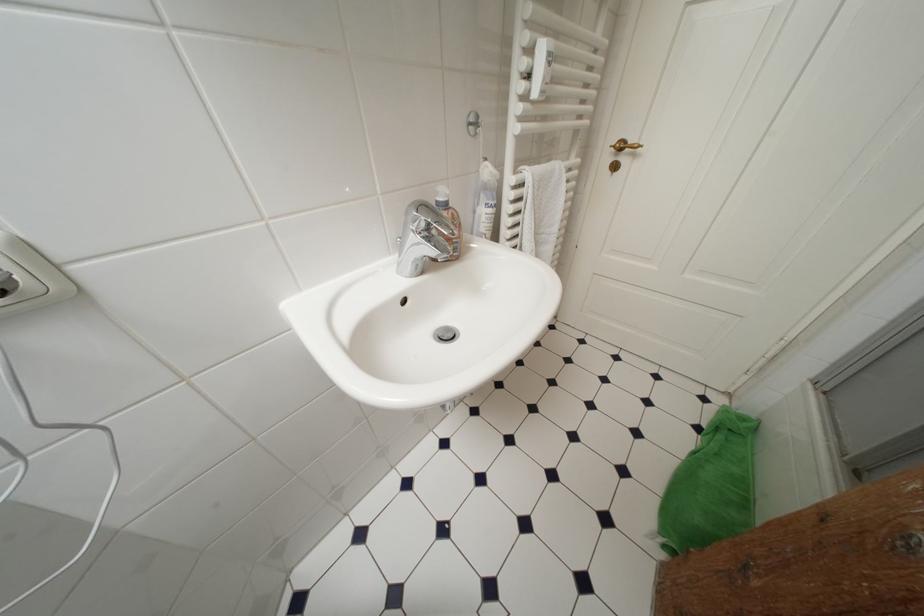
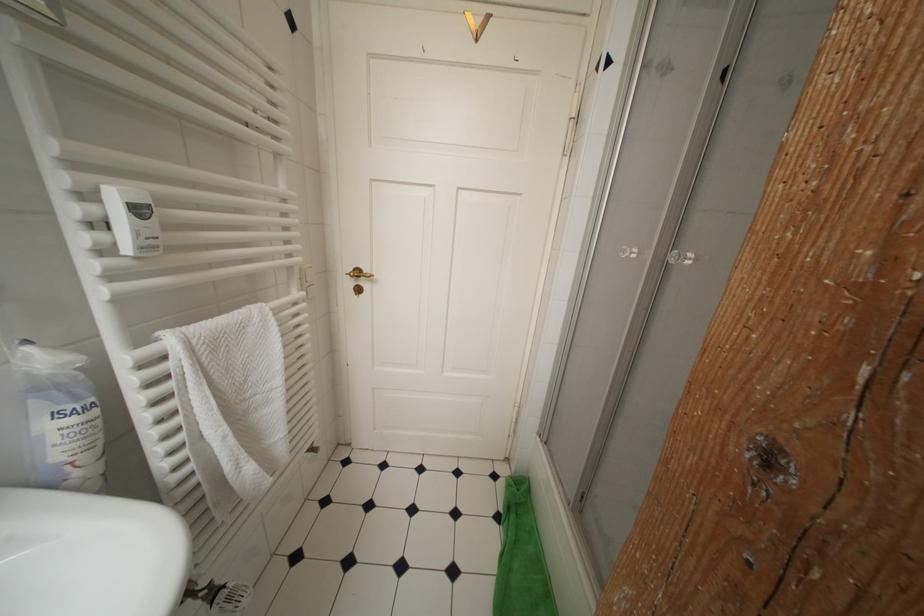
Question: The images are taken continuously from a first-person perspective. In which direction is your viewpoint rotating?

Choices:
 (A) Left
 (B) Right
 (C) Up
 (D) Down

Answer: (B)